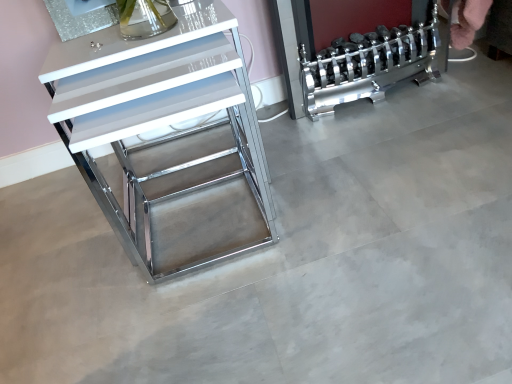
This screenshot has height=384, width=512. I want to click on free space that is to the left of white glossy drawer at left, so 65,222.